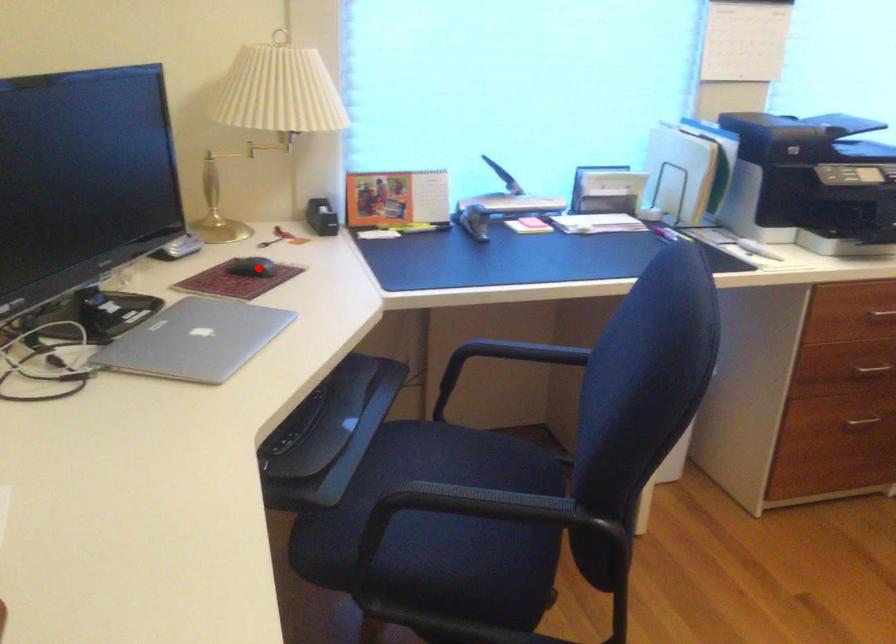
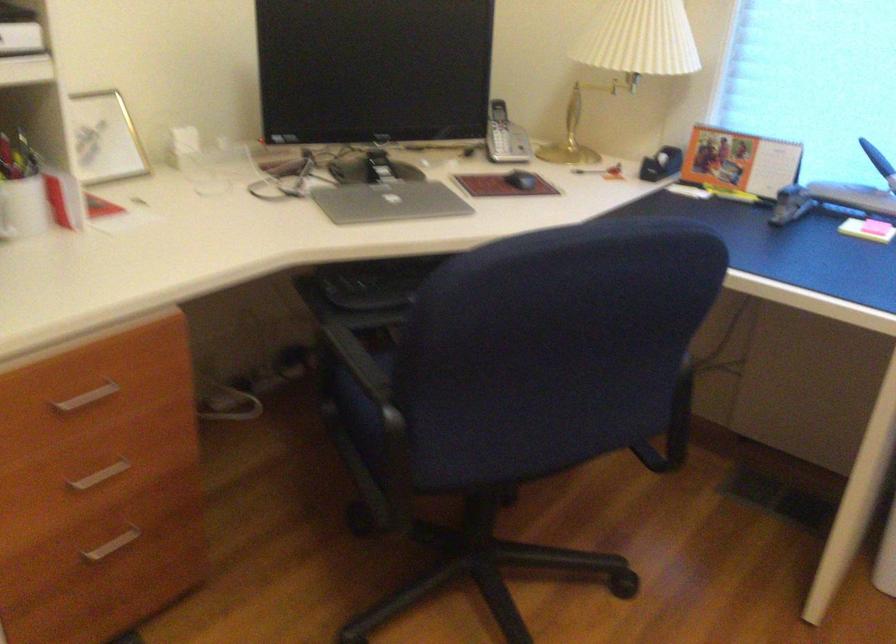
Question: I am providing you with two images of the same scene from different viewpoints. A red point is marked on the first image. Can you still see the location of the red point in image 2?

Choices:
 (A) Yes
 (B) No

Answer: (A)